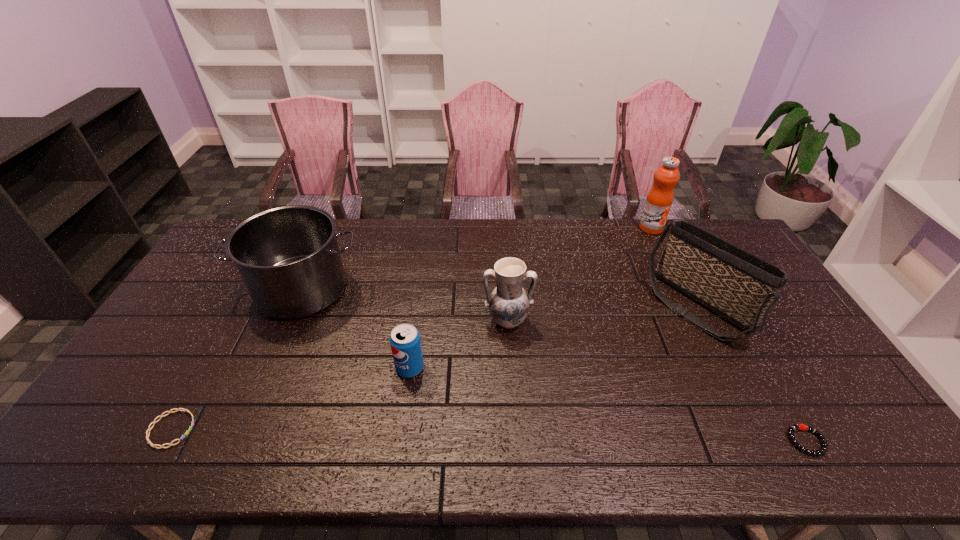
Identify the location of free point located 0.240m on the front of the saucepan. The width and height of the screenshot is (960, 540). (256, 394).

This screenshot has width=960, height=540. What are the coordinates of `free space located on either side of the fourth object from right to left` in the screenshot? It's located at (516, 450).

Identify the location of free point located 0.330m on the left of the handbag. This screenshot has height=540, width=960. (547, 307).

The image size is (960, 540). What are the coordinates of `free region located 0.190m on the left of the third shortest object` in the screenshot? It's located at (326, 368).

The width and height of the screenshot is (960, 540). In order to click on vacant space positioned 0.340m on the surface of the left bracelet showing star-shaped elements in this screenshot , I will do `click(333, 429)`.

Find the location of a particular element. vacant region located 0.220m on the back of the right bracelet is located at coordinates (756, 354).

Where is `object located at the far edge`? object located at the far edge is located at coordinates (660, 197).

Identify the location of object that is at the left edge. (185, 410).

Locate an element on the screen. The image size is (960, 540). handbag present at the right edge is located at coordinates [x=740, y=287].

You are a GUI agent. You are given a task and a screenshot of the screen. Output one action in this format:
    pyautogui.click(x=<x>, y=<y>)
    Task: Click on the bracelet that is at the right edge
    
    Given the screenshot: What is the action you would take?
    pyautogui.click(x=794, y=427)